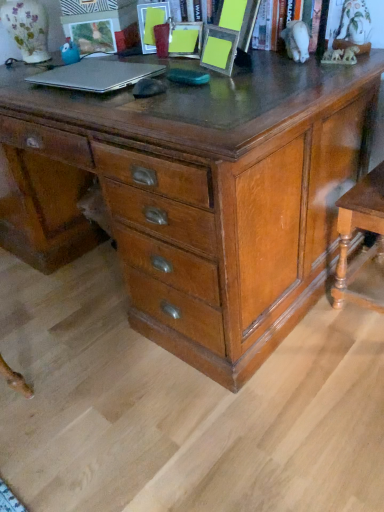
Where is `vacant space in between wooden table at lower right and shiny brown wooden chest of drawers at center`? The image size is (384, 512). vacant space in between wooden table at lower right and shiny brown wooden chest of drawers at center is located at coordinates (316, 350).